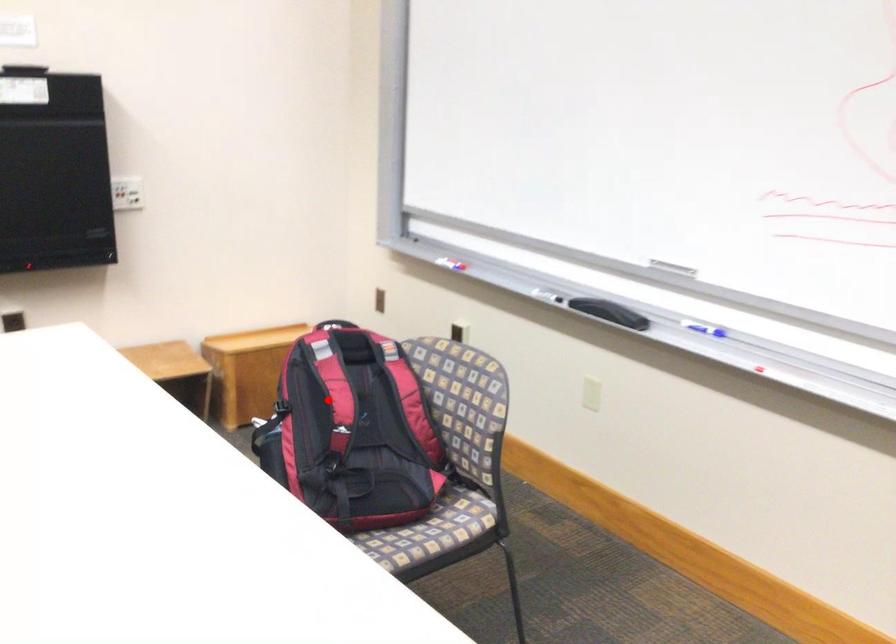
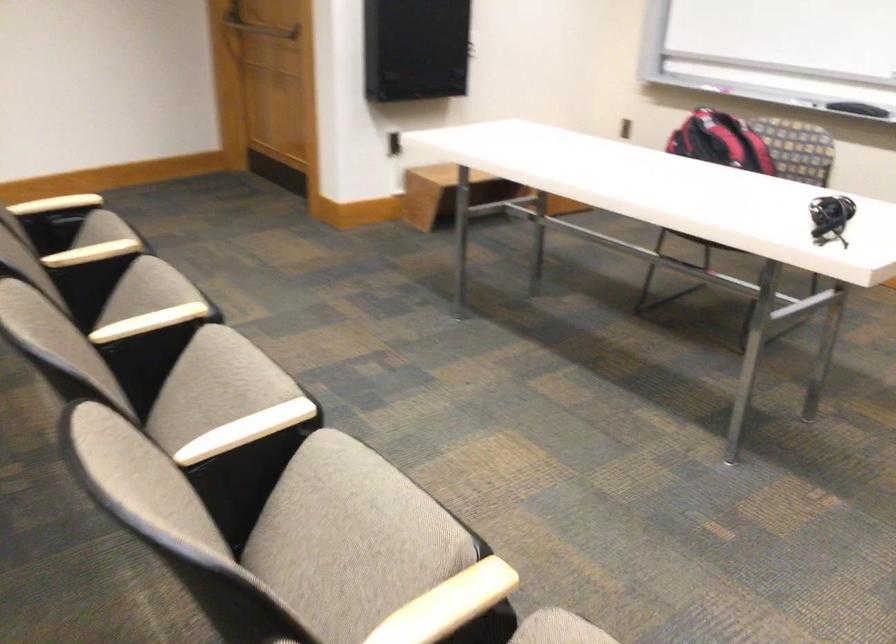
Where in the second image is the point corresponding to the highlighted location from the first image?

(720, 142)